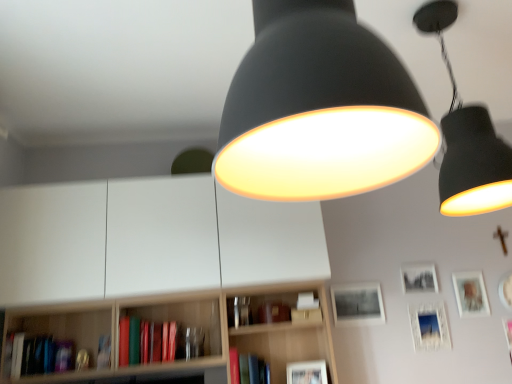
Question: Considering the positions of point (103, 349) and point (308, 26), is point (103, 349) closer or farther from the camera than point (308, 26)?

Choices:
 (A) closer
 (B) farther

Answer: (B)

Question: Is hardcover book at lower left, the second book from the left, situated inside matte black lampshade at upper center, which appears as the 2th lamp when viewed from the right, or outside?

Choices:
 (A) inside
 (B) outside

Answer: (B)

Question: Estimate the real-world distances between objects in this image. Which object is farther from the matte black picture frame at center, arranged as the fourth picture frame when viewed from the right?

Choices:
 (A) matte white picture frame at lower right, the 4th picture frame viewed from the left
 (B) matte white picture frame at lower center, the first picture frame in the left-to-right sequence
 (C) matte black lampshade at upper center, which appears as the 2th lamp when viewed from the right
 (D) white matte bookcase at center
 (E) matte white picture frame at upper right, placed as the fifth picture frame when sorted from left to right

Answer: (C)

Question: Estimate the real-world distances between objects in this image. Which object is closer to the matte red book at center, which is the 2th book in right-to-left order?

Choices:
 (A) matte black lampshade at upper center, which is the 1th lamp from front to back
 (B) white matte bookcase at center
 (C) matte white picture frame at lower right, which appears as the second picture frame when viewed from the right
 (D) matte black picture frame at center, which is the 2th picture frame in left-to-right order
 (E) black matte picture frame at upper right, the 3th picture frame in the left-to-right sequence

Answer: (D)